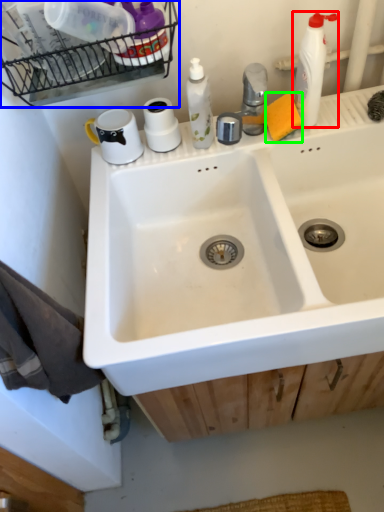
Question: Considering the real-world distances, which object is farthest from cleaning product (highlighted by a red box)? shelf (highlighted by a blue box) or soap (highlighted by a green box)?

Choices:
 (A) shelf
 (B) soap

Answer: (A)